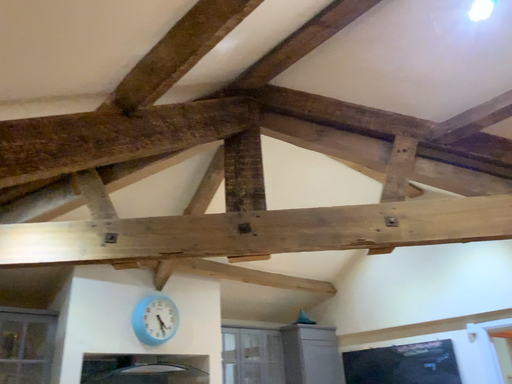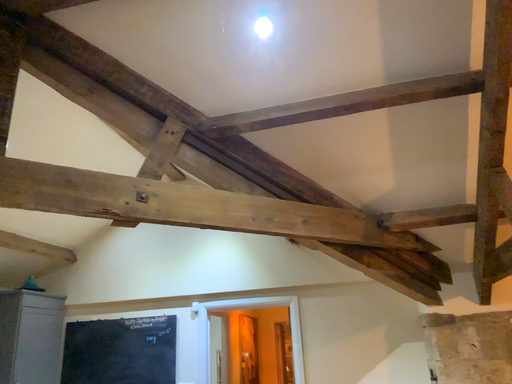
Question: How did the camera likely rotate when shooting the video?

Choices:
 (A) rotated upward
 (B) rotated downward

Answer: (B)